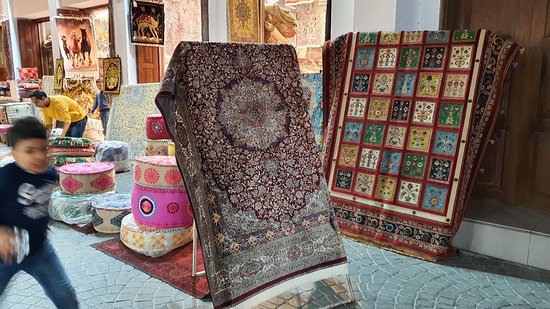
Image resolution: width=550 pixels, height=309 pixels. Find the location of `red rug on the ground`. red rug on the ground is located at coordinates (178, 277).